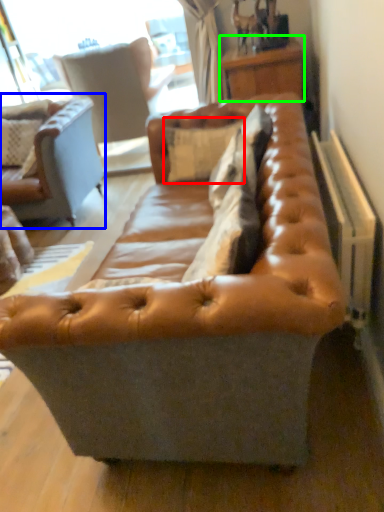
Question: Which object is positioned closest to pillow (highlighted by a red box)? Select from studio couch (highlighted by a blue box) and table (highlighted by a green box).

Choices:
 (A) studio couch
 (B) table

Answer: (B)